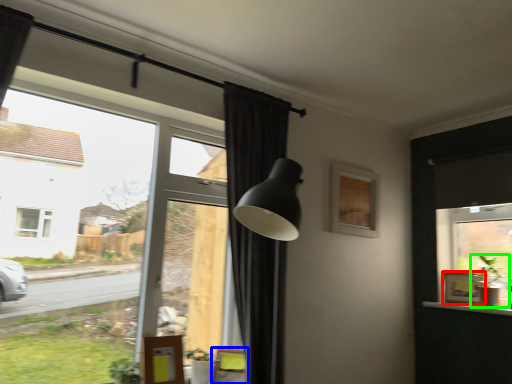
Question: Which is farther away from picture frame (highlighted by a red box)? swivel chair (highlighted by a blue box) or houseplant (highlighted by a green box)?

Choices:
 (A) swivel chair
 (B) houseplant

Answer: (A)